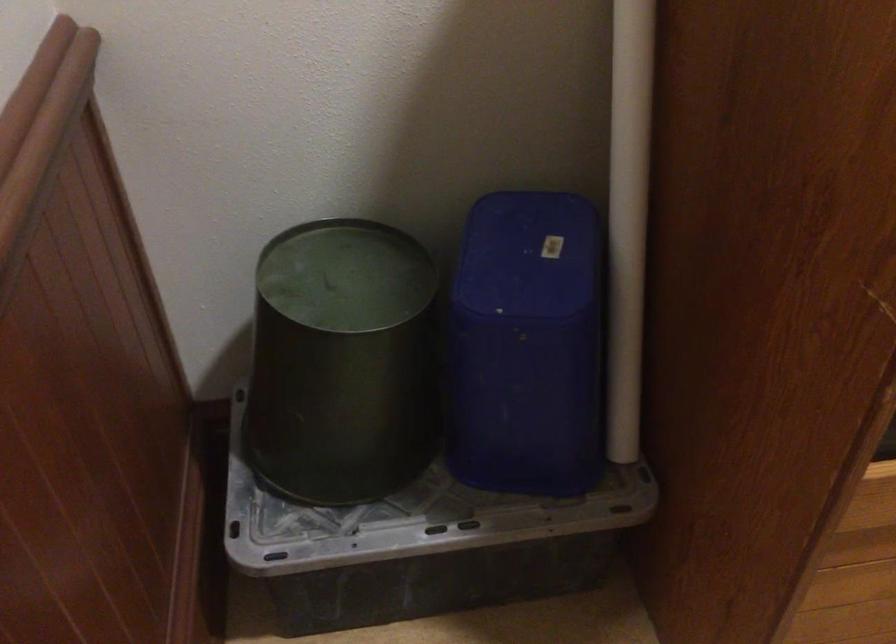
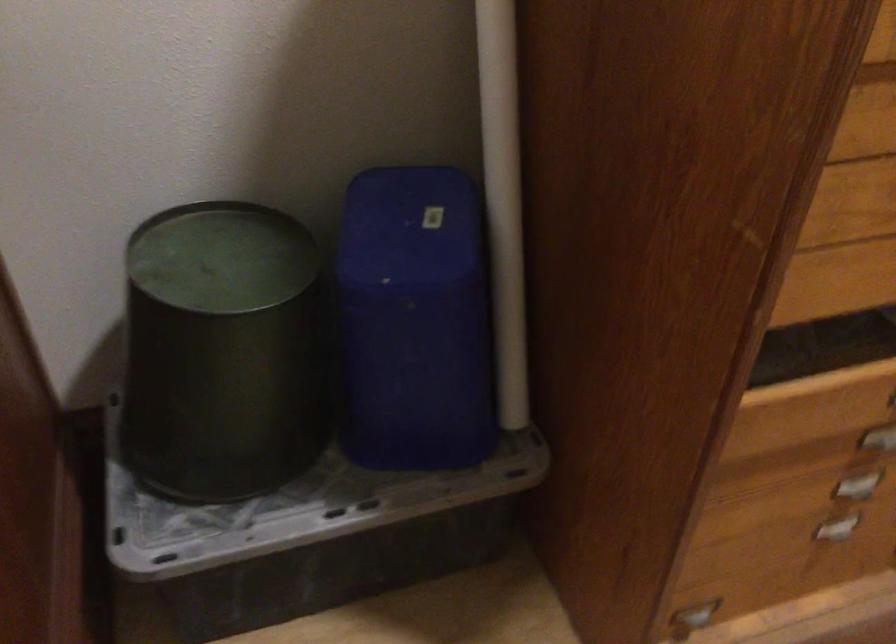
The point at (526, 352) is marked in the first image. Where is the corresponding point in the second image?

(414, 321)